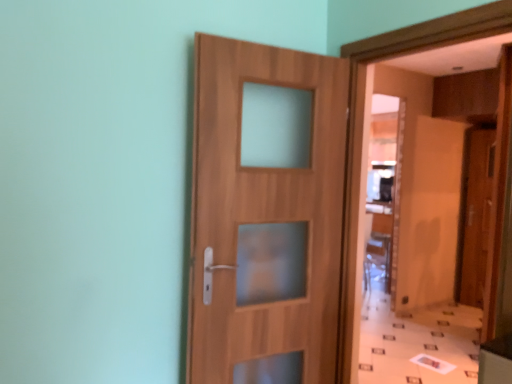
Question: From a real-world perspective, is wooden door at right, marked as the second door in a front-to-back arrangement, on wooden door at center, which ranks as the 2th door in back-to-front order?

Choices:
 (A) yes
 (B) no

Answer: (B)

Question: Is wooden door at right, which is the 1th door in back-to-front order, positioned with its back to wooden door at center, which ranks as the 2th door in back-to-front order?

Choices:
 (A) yes
 (B) no

Answer: (B)

Question: Is wooden door at right, the second door in the left-to-right sequence, at the right side of wooden door at center, which is the 2th door from right to left?

Choices:
 (A) yes
 (B) no

Answer: (A)

Question: From a real-world perspective, is wooden door at right, marked as the second door in a front-to-back arrangement, under wooden door at center, which is the 2th door from right to left?

Choices:
 (A) no
 (B) yes

Answer: (B)

Question: Can you confirm if wooden door at right, which is the 1th door in back-to-front order, is wider than wooden door at center, which is the 2th door from right to left?

Choices:
 (A) no
 (B) yes

Answer: (B)

Question: Is the position of wooden door at right, marked as the second door in a front-to-back arrangement, less distant than that of wooden door at center, which ranks as the 2th door in back-to-front order?

Choices:
 (A) yes
 (B) no

Answer: (B)

Question: Is wooden door at center, which is the first door from left to right, wider than wooden door at right, which is the 1th door in back-to-front order?

Choices:
 (A) no
 (B) yes

Answer: (A)

Question: Considering the relative positions of wooden door at center, which ranks as the 2th door in back-to-front order, and wooden door at right, marked as the second door in a front-to-back arrangement, in the image provided, is wooden door at center, which ranks as the 2th door in back-to-front order, to the right of wooden door at right, marked as the second door in a front-to-back arrangement, from the viewer's perspective?

Choices:
 (A) yes
 (B) no

Answer: (B)

Question: Considering the relative sizes of wooden door at center, which is the 2th door from right to left, and wooden door at right, which is the 1th door in back-to-front order, in the image provided, is wooden door at center, which is the 2th door from right to left, smaller than wooden door at right, which is the 1th door in back-to-front order,?

Choices:
 (A) yes
 (B) no

Answer: (A)

Question: Are wooden door at center, which is the 2th door from right to left, and wooden door at right, the second door in the left-to-right sequence, far apart?

Choices:
 (A) yes
 (B) no

Answer: (A)

Question: Is the depth of wooden door at center, which is the 2th door from right to left, greater than that of wooden door at right, marked as the second door in a front-to-back arrangement?

Choices:
 (A) no
 (B) yes

Answer: (A)

Question: From the image's perspective, would you say wooden door at center, the 1th door positioned from the front, is shown under wooden door at right, the second door in the left-to-right sequence?

Choices:
 (A) yes
 (B) no

Answer: (B)

Question: Would you say wooden door at center, which is the 2th door from right to left, is to the left or to the right of wooden door at right, the 1th door viewed from the right, in the picture?

Choices:
 (A) right
 (B) left

Answer: (B)